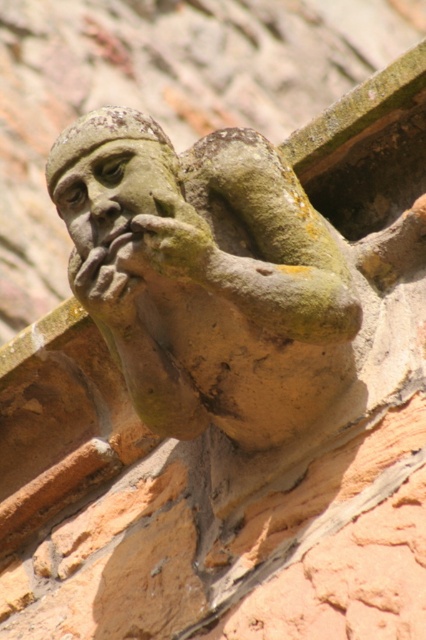
From the picture: You are an architect examining the stone gargoyle at center and the green mossy hand at center on a building roof. Which object is positioned more to the left?

The green mossy hand at center is positioned more to the left than the stone gargoyle at center.